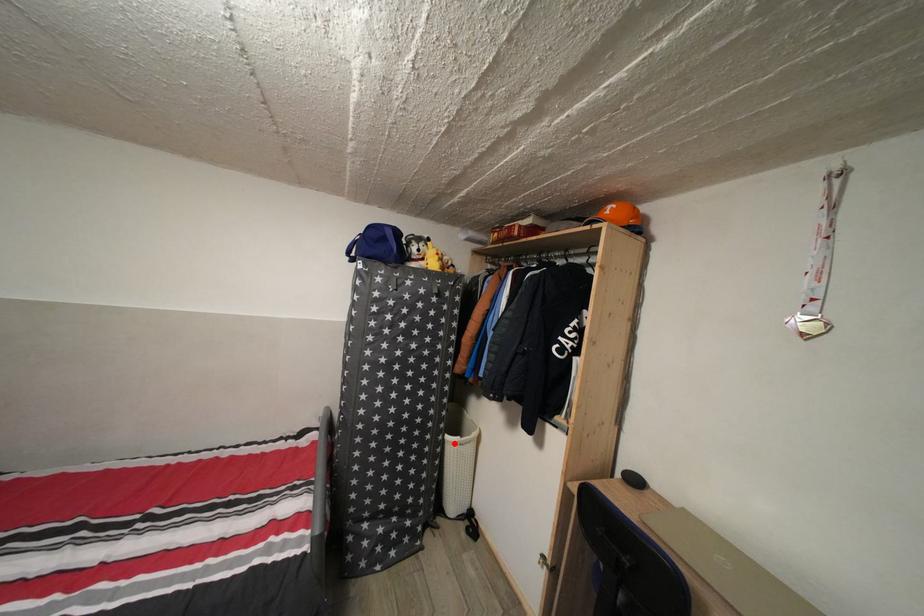
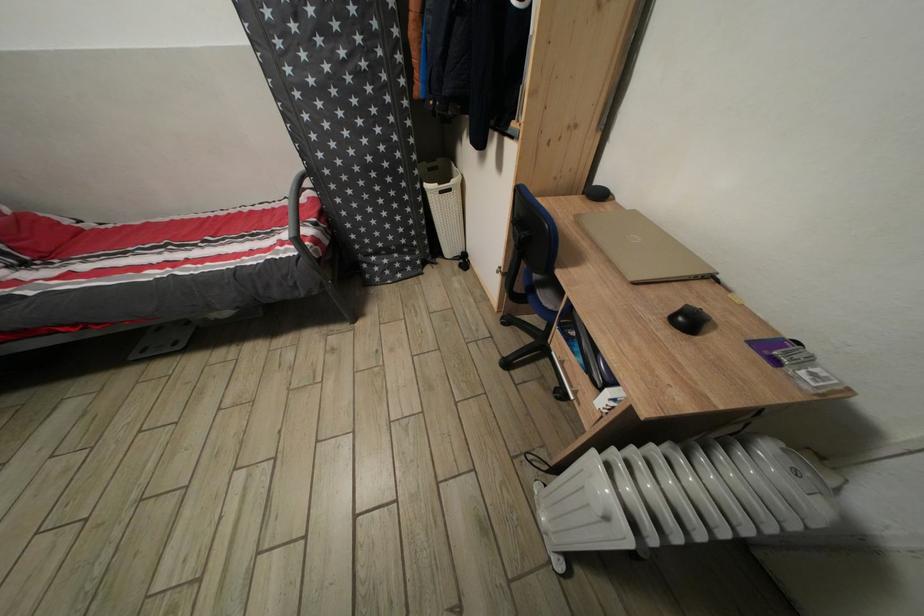
Question: A red point is marked in image1. In image2, is the corresponding 3D point closer to the camera or farther? Reply with the corresponding letter.

Choices:
 (A) The corresponding 3D point is closer.
 (B) The corresponding 3D point is farther.

Answer: (A)